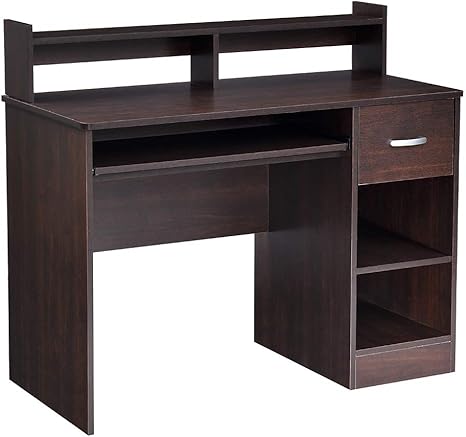
You are a GUI agent. You are given a task and a screenshot of the screen. Output one action in this format:
    pyautogui.click(x=<x>, y=<y>)
    Task: Click on the two empty drawers
    
    Given the screenshot: What is the action you would take?
    [398, 296], [393, 228]